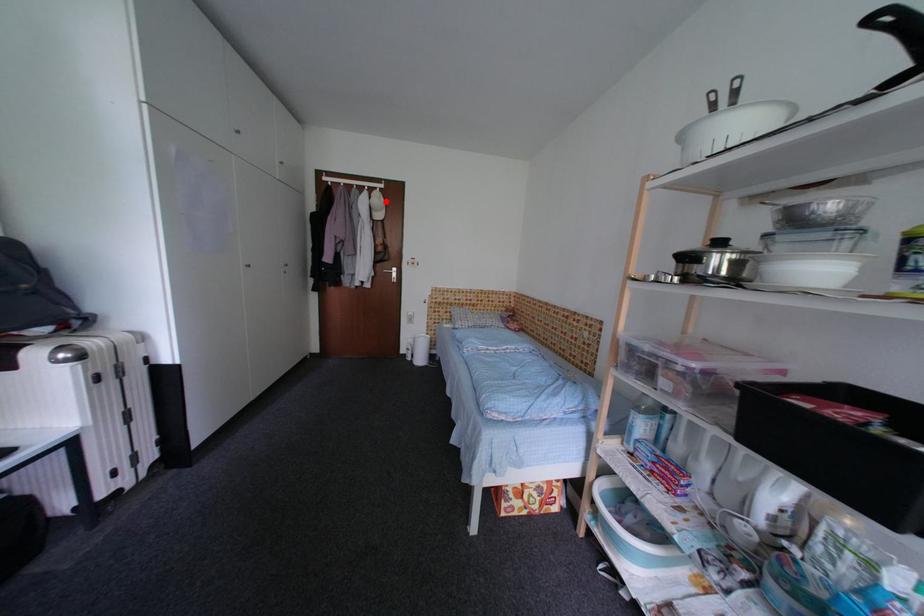
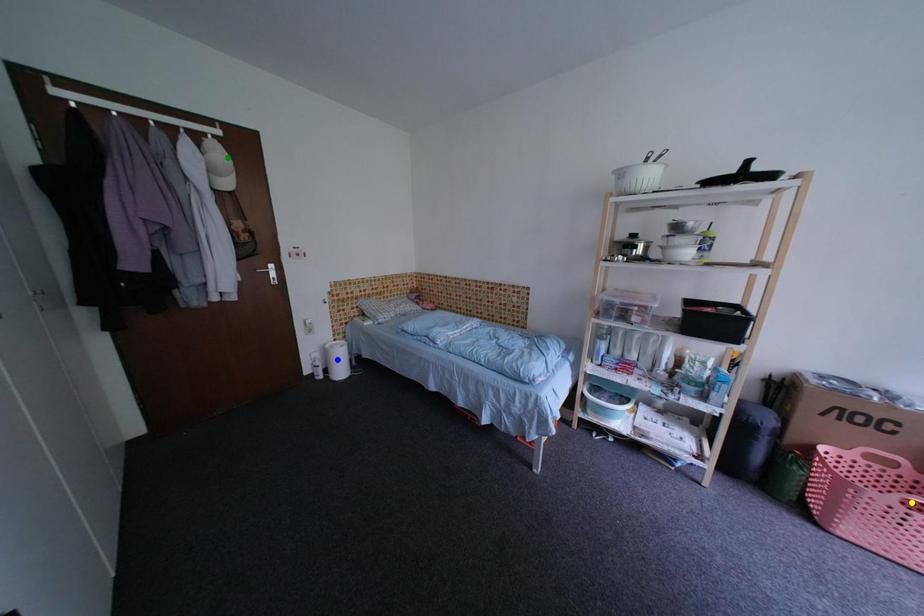
Question: I am providing you with two images of the same scene from different viewpoints. A red point is marked on the first image. You are given multiple points on the second image. Which point in image 2 is actually the same real-world point as the red point in image 1?

Choices:
 (A) blue point
 (B) green point
 (C) yellow point

Answer: (B)